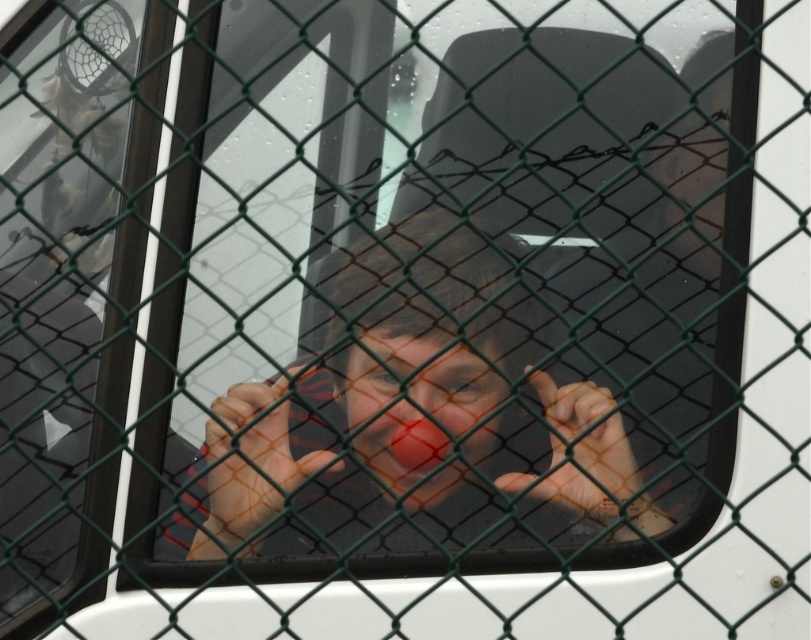
You are a photographer standing outside the vehicle, holding a camera. You want to take a clear photo of the matte red clown nose at center through the green chain link fence. The camera is 1.53 meters away from the nose. Considering the fence is slightly wet, will the water on the fence affect the clarity of the photo?

The matte red clown nose at center and camera are 1.53 meters apart from each other. The water on the green chain link fence may cause some distortion or reflections, but since the distance is manageable and the nose is the central focus, the photo should still be clear enough despite the wet fence.